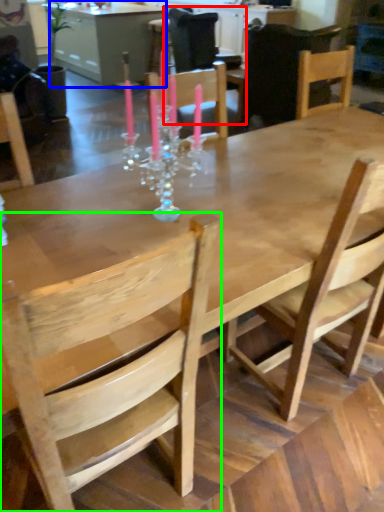
Question: Which object is the closest to the chair (highlighted by a red box)? Choose among these: table (highlighted by a blue box) or chair (highlighted by a green box).

Choices:
 (A) table
 (B) chair

Answer: (A)